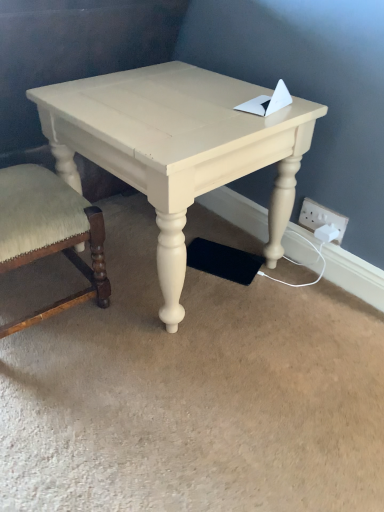
Locate an element on the screen. This screenshot has width=384, height=512. vacant area situated below matte cream table at center (from a real-world perspective) is located at coordinates (151, 258).